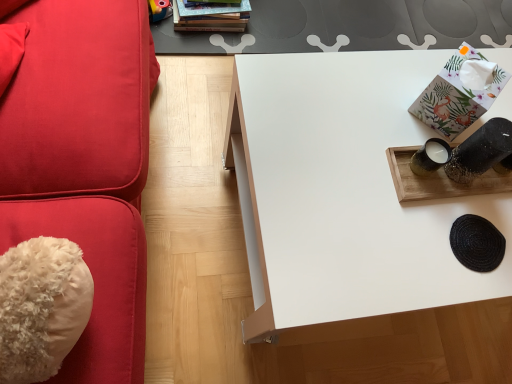
Question: Does hardcover books at upper center have a lesser height compared to white matte table at center?

Choices:
 (A) yes
 (B) no

Answer: (A)

Question: Considering the relative positions of hardcover books at upper center and white matte table at center in the image provided, is hardcover books at upper center to the right of white matte table at center from the viewer's perspective?

Choices:
 (A) yes
 (B) no

Answer: (B)

Question: Does hardcover books at upper center have a greater width compared to white matte table at center?

Choices:
 (A) no
 (B) yes

Answer: (A)

Question: Is hardcover books at upper center not near white matte table at center?

Choices:
 (A) yes
 (B) no

Answer: (B)

Question: Is hardcover books at upper center bigger than white matte table at center?

Choices:
 (A) no
 (B) yes

Answer: (A)

Question: Is the depth of hardcover books at upper center greater than that of white matte table at center?

Choices:
 (A) yes
 (B) no

Answer: (A)

Question: Is white matte table at center positioned far away from floral paper tissue at upper right?

Choices:
 (A) yes
 (B) no

Answer: (B)

Question: Considering the relative sizes of white matte table at center and floral paper tissue at upper right in the image provided, is white matte table at center taller than floral paper tissue at upper right?

Choices:
 (A) no
 (B) yes

Answer: (B)

Question: Is the depth of white matte table at center greater than that of floral paper tissue at upper right?

Choices:
 (A) yes
 (B) no

Answer: (B)

Question: Is white matte table at center oriented towards floral paper tissue at upper right?

Choices:
 (A) yes
 (B) no

Answer: (B)

Question: Considering the relative sizes of white matte table at center and floral paper tissue at upper right in the image provided, is white matte table at center wider than floral paper tissue at upper right?

Choices:
 (A) yes
 (B) no

Answer: (A)

Question: Can you confirm if white matte table at center is bigger than floral paper tissue at upper right?

Choices:
 (A) yes
 (B) no

Answer: (A)

Question: Considering the relative sizes of floral paper tissue at upper right and white matte table at center in the image provided, is floral paper tissue at upper right taller than white matte table at center?

Choices:
 (A) no
 (B) yes

Answer: (A)